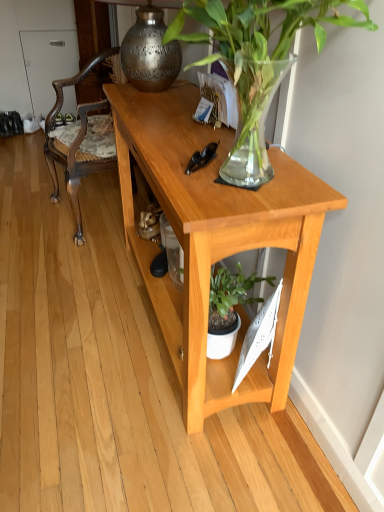
Locate an element on the screen. vacant space in front of wooden carved chair at left is located at coordinates (64, 270).